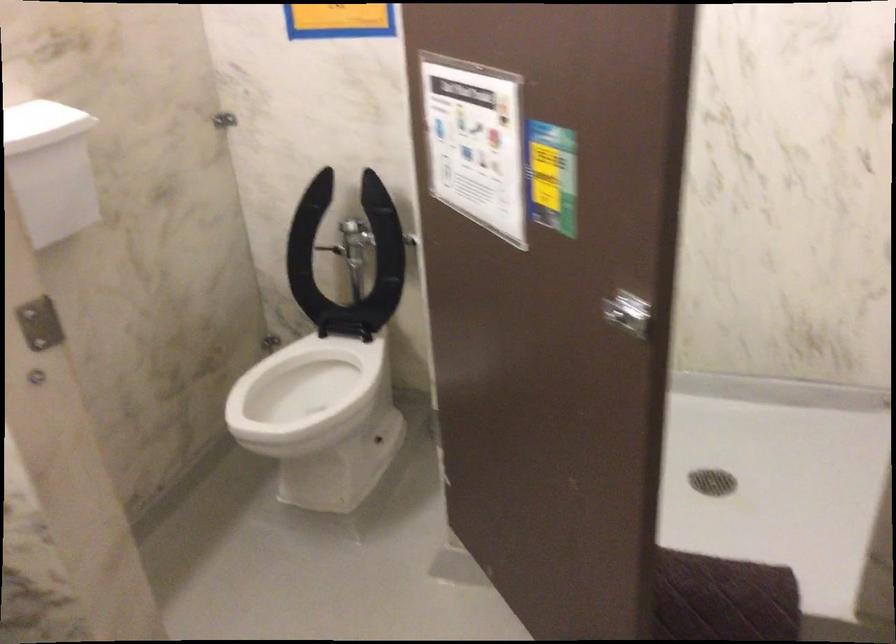
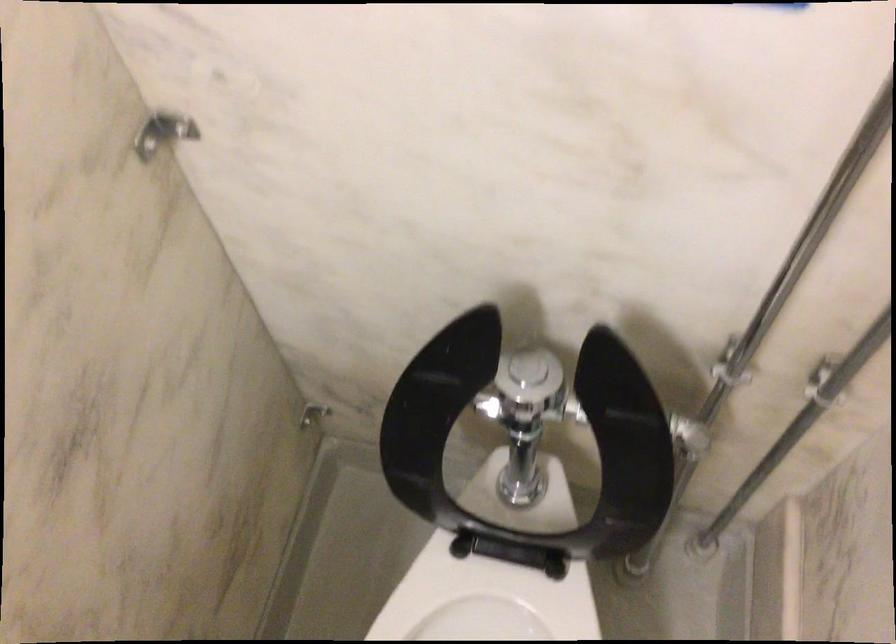
In the second image, find the point that corresponds to point (349, 216) in the first image.

(528, 368)